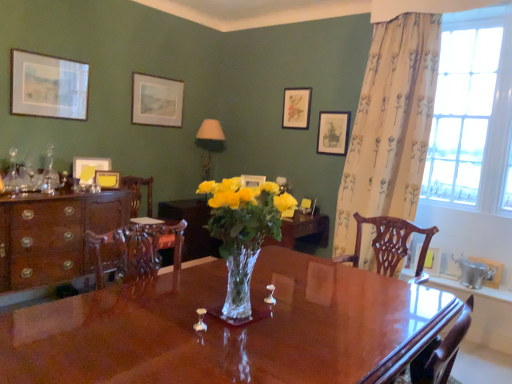
Question: Is yellow paper at left, positioned as the seventh picture frame in right-to-left order, inside the boundaries of matte paper picture frame at upper center, the fourth picture frame when ordered from left to right, or outside?

Choices:
 (A) outside
 (B) inside

Answer: (A)

Question: Relative to matte paper picture frame at upper center, the fourth picture frame when ordered from left to right, is yellow paper at left, positioned as the seventh picture frame in right-to-left order, in front or behind?

Choices:
 (A) front
 (B) behind

Answer: (A)

Question: Based on their relative distances, which object is nearer to the glossy wood desk at center?

Choices:
 (A) matte gold picture frame at upper center, which is the fifth picture frame in left-to-right order
 (B) clear glass vase at center
 (C) carved wood chair at center
 (D) mahogany wood cabinet at left
 (E) wooden picture frame at right, the 2th picture frame viewed from the right

Answer: (B)

Question: Considering the real-world distances, which object is closest to the yellow paper at left, the third picture frame when ordered from left to right?

Choices:
 (A) floral fabric curtain at right
 (B) clear glass window at upper right
 (C) carved wood chair at center
 (D) mahogany wood cabinet at left
 (E) matte white picture frame at upper left, which is the ninth picture frame in right-to-left order

Answer: (C)